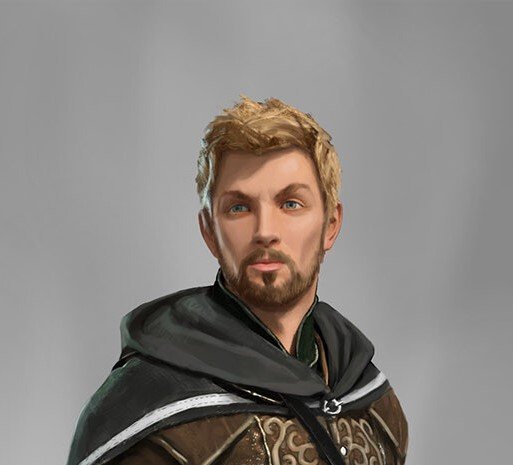
Where is `hood`? The image size is (513, 465). hood is located at coordinates (182, 329).